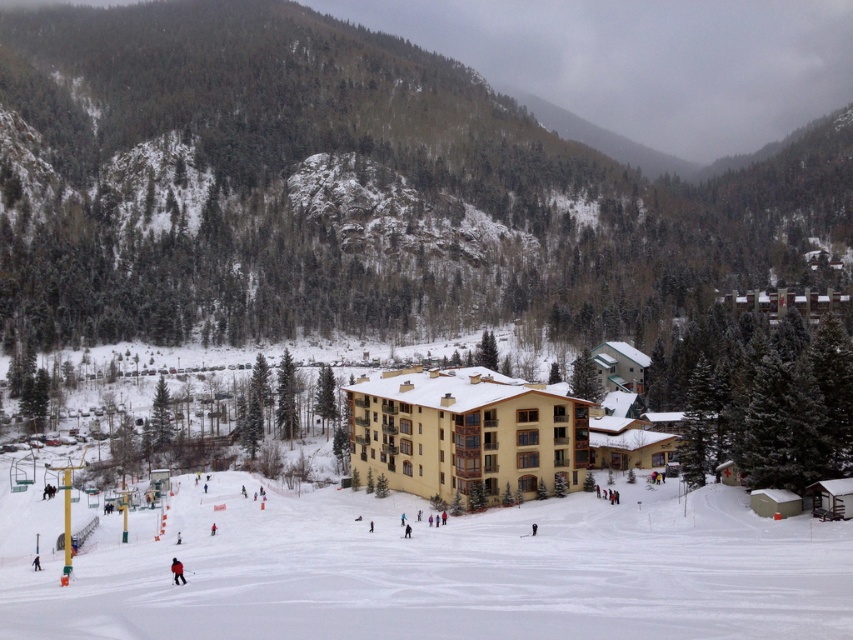
You are planning to take a photo of the yellow wood hotel at center and the red fabric jacket at lower center. Since you want both objects to appear in the frame, which object should you focus on to ensure they are both in the shot?

You should focus on the yellow wood hotel at center because its width is larger than the red fabric jacket at lower center, making it easier to frame both objects by centering the hotel and adjusting the zoom accordingly.

You are planning to take a helicopter shot of the ski resort. The camera is set to focus on the yellow wood hotel at center. Given that the hotel is at coordinate point 0.678, 0.545, where should the camera be positioned to capture the hotel in the center of the frame?

The yellow wood hotel at center is located at point (463, 433), so the camera should be positioned directly above this coordinate to ensure the hotel is centered in the helicopter shot.

You are standing at the base of the ski resort and want to reach the point marked as point (0,621). If your average skiing speed is 12 meters per second, how long will it take you to reach that point?

The distance between you and point (0,621) is 46.30 meters. At an average speed of 12 meters per second, it will take approximately 3.86 seconds to reach the point.